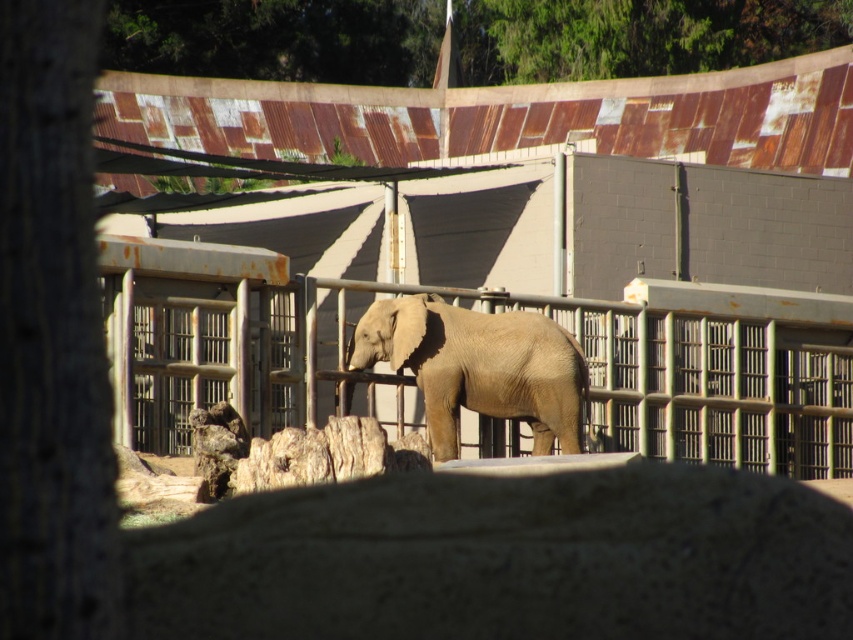
From the picture: Is green leafy tree at upper center behind smooth beige elephant at center?

That is True.

Based on the photo, between green leafy tree at upper center and smooth beige elephant at center, which one appears on the left side from the viewer's perspective?

smooth beige elephant at center is more to the left.

Between point (294, 13) and point (527, 312), which one is positioned in front?

Point (527, 312) is in front.

Locate an element on the screen. Image resolution: width=853 pixels, height=640 pixels. green leafy tree at upper center is located at coordinates (636, 36).

Does point (97, 403) lie behind point (434, 433)?

No, (97, 403) is closer to viewer.

This screenshot has width=853, height=640. Identify the location of brown rough bark tree at left. (51, 336).

Who is more forward, (74, 122) or (579, 44)?

Point (74, 122)

Does brown rough bark tree at left appear over green leafy tree at upper center?

Incorrect, brown rough bark tree at left is not positioned above green leafy tree at upper center.

Find the location of a particular element. Image resolution: width=853 pixels, height=640 pixels. brown rough bark tree at left is located at coordinates [x=51, y=336].